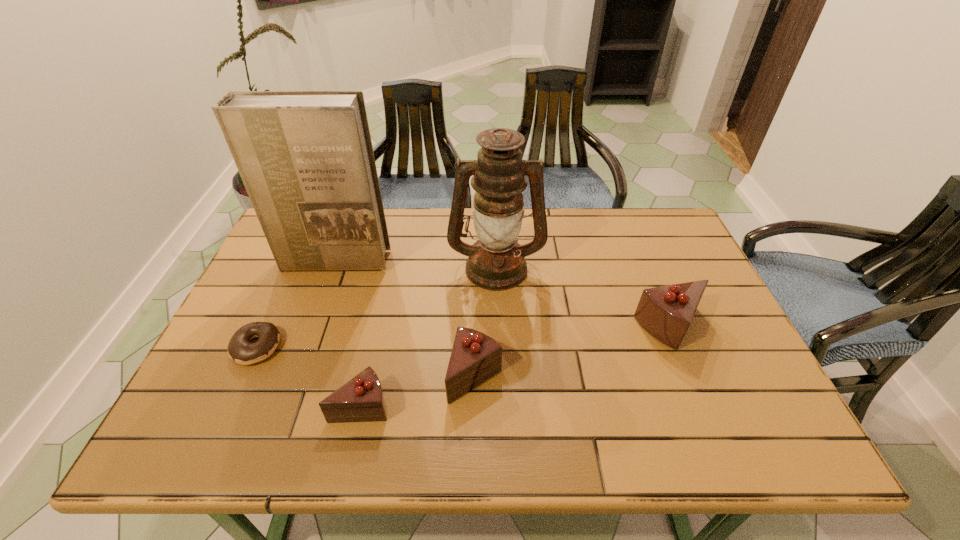
Identify the location of vacant area at the far edge of the desktop. (547, 251).

Where is `vacant area at the near edge`? This screenshot has height=540, width=960. vacant area at the near edge is located at coordinates (533, 389).

In the image, there is a desktop. What are the coordinates of `blank space at the right edge` in the screenshot? It's located at (652, 262).

Find the location of a particular element. blank region between the shortest chocolate cake and the fourth tallest object is located at coordinates (418, 390).

Locate an element on the screen. This screenshot has width=960, height=540. free spot between the fourth tallest object and the lantern is located at coordinates (486, 321).

The image size is (960, 540). Identify the location of vacant space in between the doughnut and the fifth tallest object. (308, 375).

Find the location of `vacant space that is in between the shortest chocolate cake and the doughnut`. vacant space that is in between the shortest chocolate cake and the doughnut is located at coordinates (308, 375).

The width and height of the screenshot is (960, 540). What are the coordinates of `vacant space that is in between the rightmost object and the third shortest object` in the screenshot? It's located at (573, 352).

Where is `free space between the rightmost chocolate cake and the third shortest object`? This screenshot has width=960, height=540. free space between the rightmost chocolate cake and the third shortest object is located at coordinates (573, 352).

Where is `vacant area between the lantern and the shortest chocolate cake`? Image resolution: width=960 pixels, height=540 pixels. vacant area between the lantern and the shortest chocolate cake is located at coordinates (428, 335).